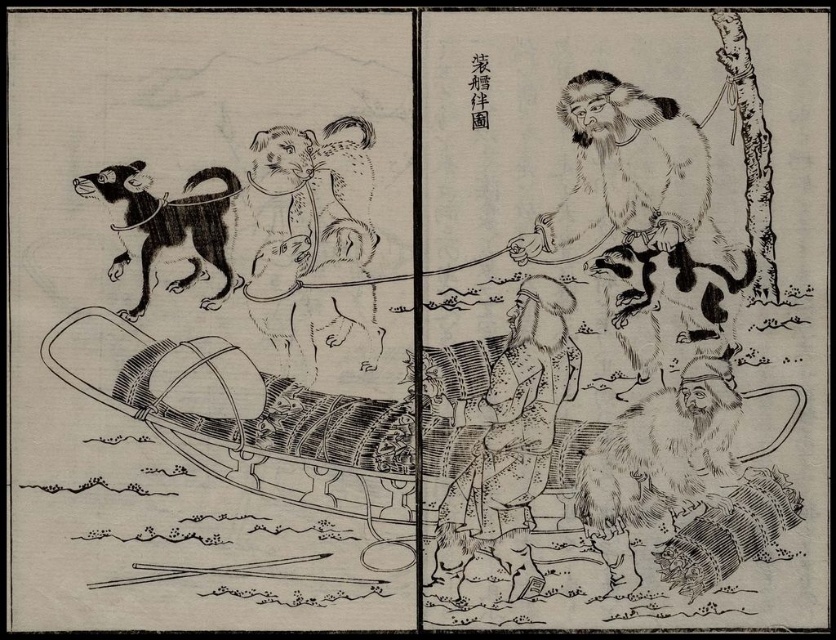
Does point (571, 88) come closer to viewer compared to point (130, 163)?

No, (571, 88) is behind (130, 163).

Consider the image. Is furry black dog at upper right smaller than black fur cat at upper left?

No, furry black dog at upper right is not smaller than black fur cat at upper left.

Find the location of a particular element. furry black dog at upper right is located at coordinates (628, 172).

Between fluffy fur skunk at center and black fur cat at upper left, which one is positioned lower?

Positioned lower is fluffy fur skunk at center.

Where is `fluffy fur skunk at center`? Image resolution: width=836 pixels, height=640 pixels. fluffy fur skunk at center is located at coordinates click(x=666, y=304).

This screenshot has width=836, height=640. Identify the location of furry brown dog at lower right. (660, 460).

The height and width of the screenshot is (640, 836). In order to click on furry brown dog at lower right in this screenshot , I will do `click(660, 460)`.